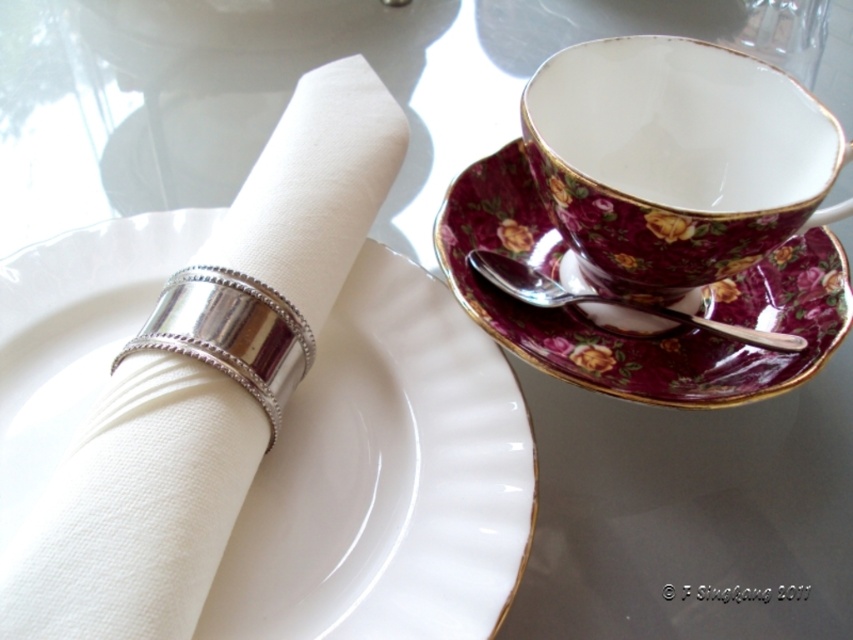
Consider the image. You are setting up a table for a formal event and need to stack the white porcelain plate at center and the maroon floral porcelain saucer at upper right. Which object should be placed at the bottom of the stack to ensure stability?

The white porcelain plate at center should be placed at the bottom of the stack because it has a greater height compared to the maroon floral porcelain saucer at upper right, providing a stable base.

You are setting up a formal dining table and need to place a centerpiece. The centerpiece requires a surface area larger than the silver metallic spoon at upper right. Can the white porcelain plate at center accommodate it?

The white porcelain plate at center is larger in size than the silver metallic spoon at upper right, so it can accommodate the centerpiece requiring a larger surface area.

You are setting up a formal tea service and need to place the maroon floral porcelain saucer at upper right and the silver metallic spoon at upper right on a narrow shelf. Which item should you place first to ensure both fit side by side?

The silver metallic spoon at upper right is narrower than the maroon floral porcelain saucer at upper right, so place the spoon first to leave space for the wider saucer.